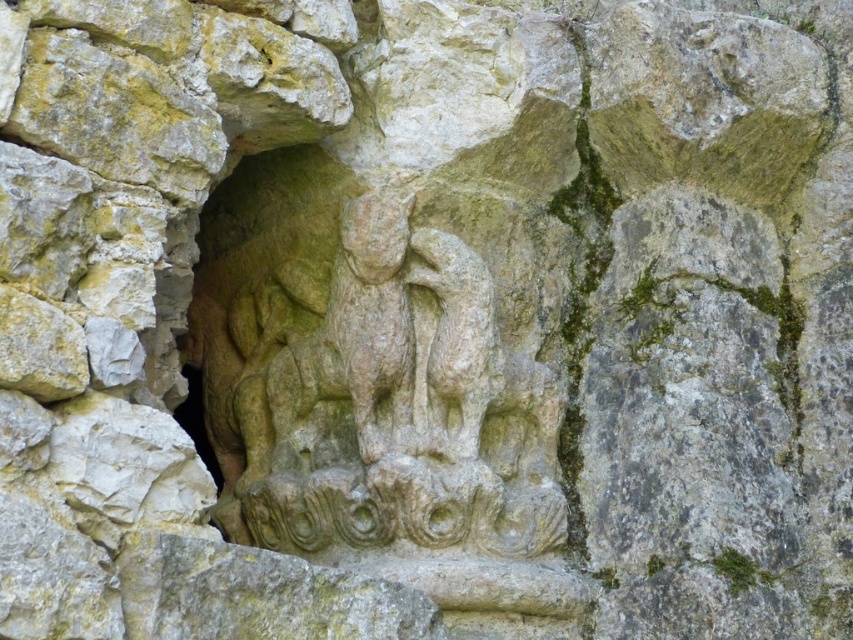
Question: Which object appears farthest from the camera in this image?

Choices:
 (A) stone relief sculpture at center
 (B) stone carving at center

Answer: (B)

Question: Is stone relief sculpture at center above stone carving at center?

Choices:
 (A) no
 (B) yes

Answer: (A)

Question: Is stone relief sculpture at center positioned behind stone carving at center?

Choices:
 (A) no
 (B) yes

Answer: (A)

Question: Can you confirm if stone relief sculpture at center is wider than stone carving at center?

Choices:
 (A) no
 (B) yes

Answer: (B)